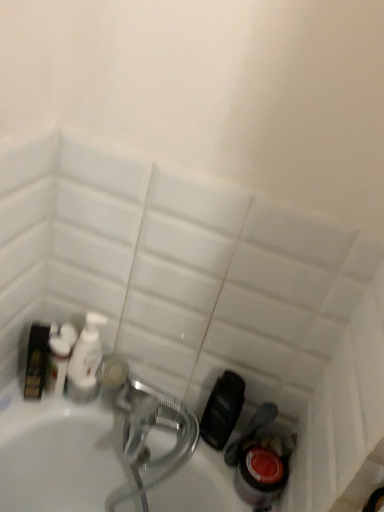
Question: Should I look upward or downward to see white glossy pump bottle at center, acting as the second cleaning product starting from the left?

Choices:
 (A) down
 (B) up

Answer: (A)

Question: Could you tell me if white glossy pump bottle at center, acting as the second cleaning product starting from the left, is turned towards white glossy bottle at left, which appears as the second cleaning product when viewed from the right?

Choices:
 (A) yes
 (B) no

Answer: (B)

Question: From the image's perspective, is white glossy pump bottle at center, which appears as the first cleaning product when viewed from the right, located above white glossy bottle at left, which ranks as the first cleaning product in left-to-right order?

Choices:
 (A) yes
 (B) no

Answer: (B)

Question: Is white glossy pump bottle at center, which appears as the first cleaning product when viewed from the right, next to white glossy bottle at left, which appears as the second cleaning product when viewed from the right?

Choices:
 (A) no
 (B) yes

Answer: (B)

Question: Is white glossy pump bottle at center, which appears as the first cleaning product when viewed from the right, wider than white glossy bottle at left, which appears as the second cleaning product when viewed from the right?

Choices:
 (A) yes
 (B) no

Answer: (A)

Question: From the image's perspective, does white glossy pump bottle at center, acting as the second cleaning product starting from the left, appear lower than white glossy bottle at left, which appears as the second cleaning product when viewed from the right?

Choices:
 (A) yes
 (B) no

Answer: (A)

Question: Is white glossy pump bottle at center, which appears as the first cleaning product when viewed from the right, outside of white glossy bottle at left, which ranks as the first cleaning product in left-to-right order?

Choices:
 (A) yes
 (B) no

Answer: (A)

Question: Is white glossy bottle at left, which appears as the second cleaning product when viewed from the right, positioned with its back to white glossy pump bottle at center, which appears as the first cleaning product when viewed from the right?

Choices:
 (A) yes
 (B) no

Answer: (B)

Question: Does white glossy bottle at left, which appears as the second cleaning product when viewed from the right, turn towards white glossy pump bottle at center, acting as the second cleaning product starting from the left?

Choices:
 (A) no
 (B) yes

Answer: (A)

Question: Is white glossy bottle at left, which ranks as the first cleaning product in left-to-right order, positioned beyond the bounds of white glossy pump bottle at center, acting as the second cleaning product starting from the left?

Choices:
 (A) no
 (B) yes

Answer: (B)

Question: Is white glossy bottle at left, which ranks as the first cleaning product in left-to-right order, at the right side of white glossy pump bottle at center, acting as the second cleaning product starting from the left?

Choices:
 (A) no
 (B) yes

Answer: (A)

Question: Can you confirm if white glossy bottle at left, which appears as the second cleaning product when viewed from the right, is wider than white glossy pump bottle at center, acting as the second cleaning product starting from the left?

Choices:
 (A) yes
 (B) no

Answer: (B)

Question: Is white glossy bottle at left, which ranks as the first cleaning product in left-to-right order, taller than white glossy pump bottle at center, which appears as the first cleaning product when viewed from the right?

Choices:
 (A) yes
 (B) no

Answer: (B)

Question: Visually, is white glossy pump bottle at center, acting as the second cleaning product starting from the left, positioned to the left or to the right of white glossy bottle at left, which ranks as the first cleaning product in left-to-right order?

Choices:
 (A) right
 (B) left

Answer: (A)